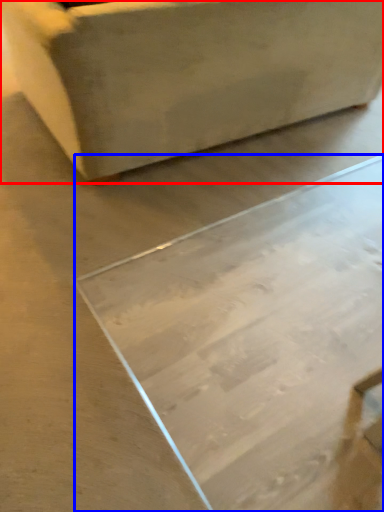
Question: Which point is further to the camera, furniture (highlighted by a red box) or table (highlighted by a blue box)?

Choices:
 (A) furniture
 (B) table

Answer: (A)